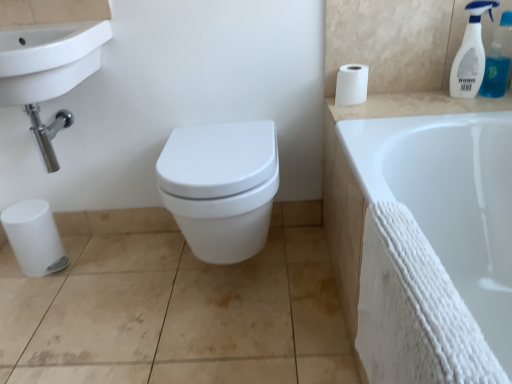
Question: Would you say white ceramic sink at upper left is a long distance from white ceramic counter top at upper right?

Choices:
 (A) yes
 (B) no

Answer: (B)

Question: Is white ceramic sink at upper left positioned with its back to white ceramic counter top at upper right?

Choices:
 (A) no
 (B) yes

Answer: (A)

Question: Is white ceramic sink at upper left positioned behind white ceramic counter top at upper right?

Choices:
 (A) no
 (B) yes

Answer: (A)

Question: Is white ceramic sink at upper left not inside white ceramic counter top at upper right?

Choices:
 (A) yes
 (B) no

Answer: (A)

Question: From a real-world perspective, is white ceramic sink at upper left physically below white ceramic counter top at upper right?

Choices:
 (A) no
 (B) yes

Answer: (A)

Question: Is white ceramic sink at upper left aimed at white ceramic counter top at upper right?

Choices:
 (A) yes
 (B) no

Answer: (B)

Question: Is white ceramic sink at upper left bigger than white matte toilet paper at upper right?

Choices:
 (A) no
 (B) yes

Answer: (B)

Question: Is white ceramic sink at upper left positioned before white matte toilet paper at upper right?

Choices:
 (A) yes
 (B) no

Answer: (A)

Question: From a real-world perspective, is white ceramic sink at upper left positioned over white matte toilet paper at upper right based on gravity?

Choices:
 (A) yes
 (B) no

Answer: (A)

Question: Considering the relative positions of white ceramic sink at upper left and white matte toilet paper at upper right in the image provided, is white ceramic sink at upper left behind white matte toilet paper at upper right?

Choices:
 (A) no
 (B) yes

Answer: (A)

Question: Is white ceramic sink at upper left placed right next to white matte toilet paper at upper right?

Choices:
 (A) yes
 (B) no

Answer: (B)

Question: Is white ceramic sink at upper left wider than white matte toilet paper at upper right?

Choices:
 (A) yes
 (B) no

Answer: (A)

Question: From a real-world perspective, is white textured towel at lower right positioned over clear plastic spray bottle at upper right, the second cleaning product in the left-to-right sequence, based on gravity?

Choices:
 (A) no
 (B) yes

Answer: (A)